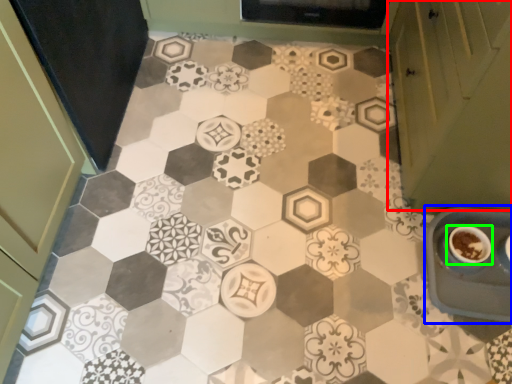
Question: Which object is positioned closest to cabinetry (highlighted by a red box)? Select from sink (highlighted by a blue box) and coffee cup (highlighted by a green box).

Choices:
 (A) sink
 (B) coffee cup

Answer: (A)